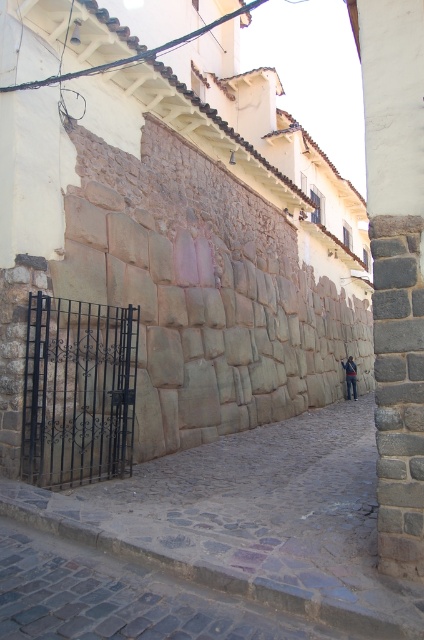
Question: Which point is closer to the camera?

Choices:
 (A) blue denim jeans at center
 (B) gray cobblestone alley at center

Answer: (B)

Question: Is gray cobblestone alley at center wider than blue denim jeans at center?

Choices:
 (A) no
 (B) yes

Answer: (B)

Question: Among these objects, which one is nearest to the camera?

Choices:
 (A) blue denim jeans at center
 (B) gray cobblestone alley at center

Answer: (B)

Question: Which object appears farthest from the camera in this image?

Choices:
 (A) gray cobblestone alley at center
 (B) blue denim jeans at center

Answer: (B)

Question: Is gray cobblestone alley at center bigger than blue denim jeans at center?

Choices:
 (A) no
 (B) yes

Answer: (B)

Question: Can you confirm if gray cobblestone alley at center is positioned below blue denim jeans at center?

Choices:
 (A) no
 (B) yes

Answer: (A)